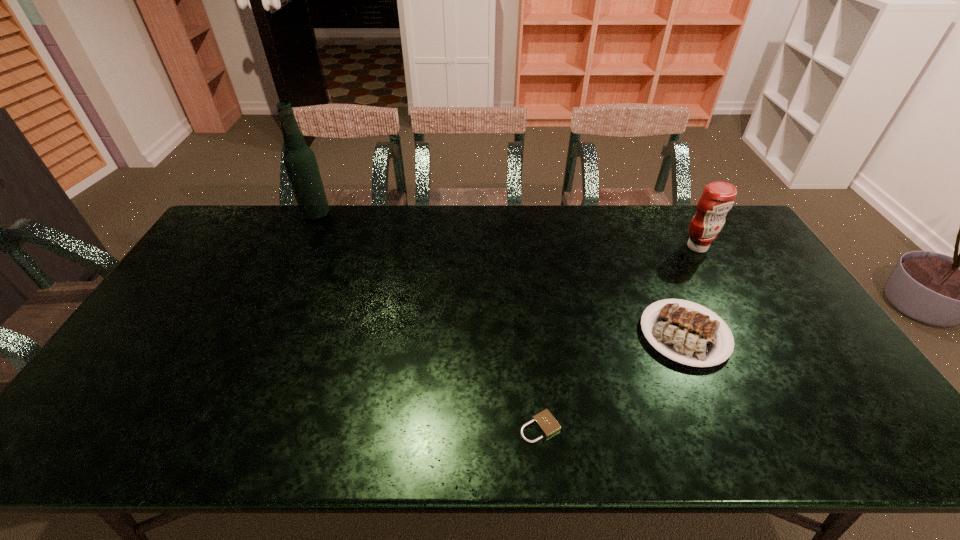
The height and width of the screenshot is (540, 960). Find the location of `the tallest object`. the tallest object is located at coordinates (300, 162).

This screenshot has height=540, width=960. I want to click on alcohol, so click(x=300, y=162).

In order to click on the second tallest object in this screenshot , I will do `click(717, 199)`.

Find the location of a particular element. Image resolution: width=960 pixels, height=540 pixels. condiment is located at coordinates (717, 199).

Identify the location of the third farthest object. This screenshot has width=960, height=540. (686, 336).

Find the location of a particular element. The image size is (960, 540). plate is located at coordinates (686, 336).

Where is `the nearest object`? the nearest object is located at coordinates (545, 421).

At what (x,y) coordinates should I click in order to perform the action: click on the third object from right to left. Please return your answer as a coordinate pair (x, y). Looking at the image, I should click on 545,421.

You are a GUI agent. You are given a task and a screenshot of the screen. Output one action in this format:
    pyautogui.click(x=<x>, y=<y>)
    Task: Click on the vacant region located on the right of the leftmost object
    This screenshot has width=960, height=540.
    Given the screenshot: What is the action you would take?
    pyautogui.click(x=395, y=215)

What are the coordinates of `vacant region located 0.270m on the front of the second farthest object` in the screenshot? It's located at (736, 315).